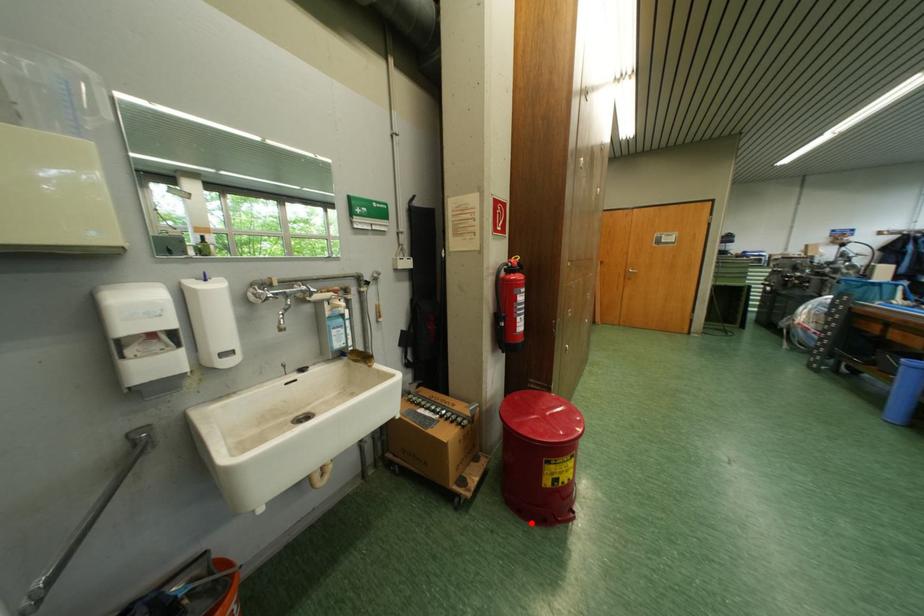
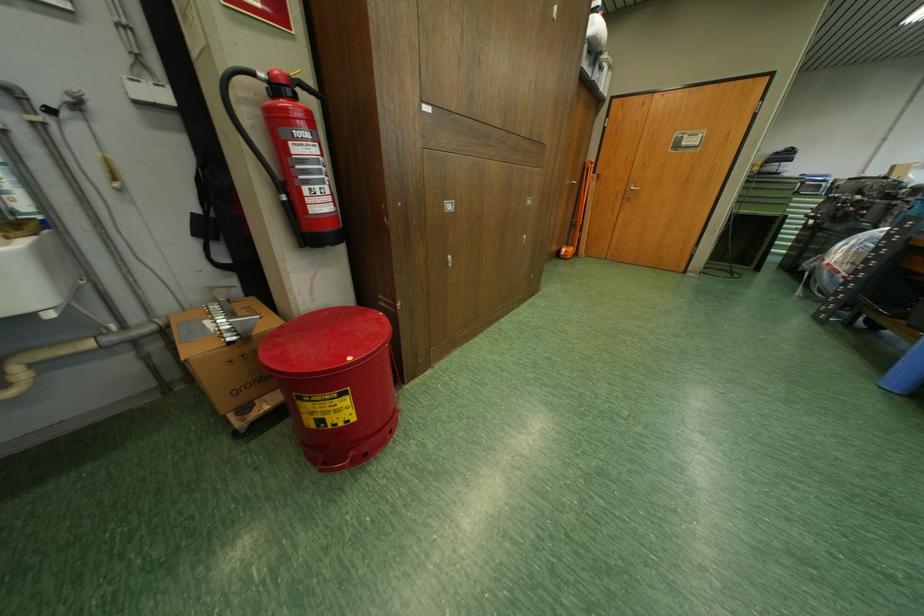
In the second image, find the point that corresponds to the highlighted location in the first image.

(314, 461)